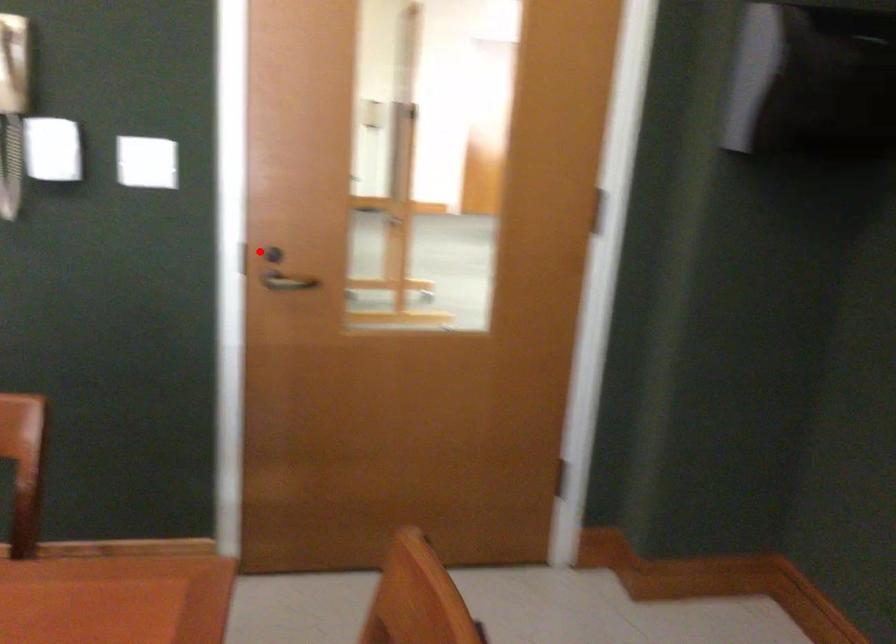
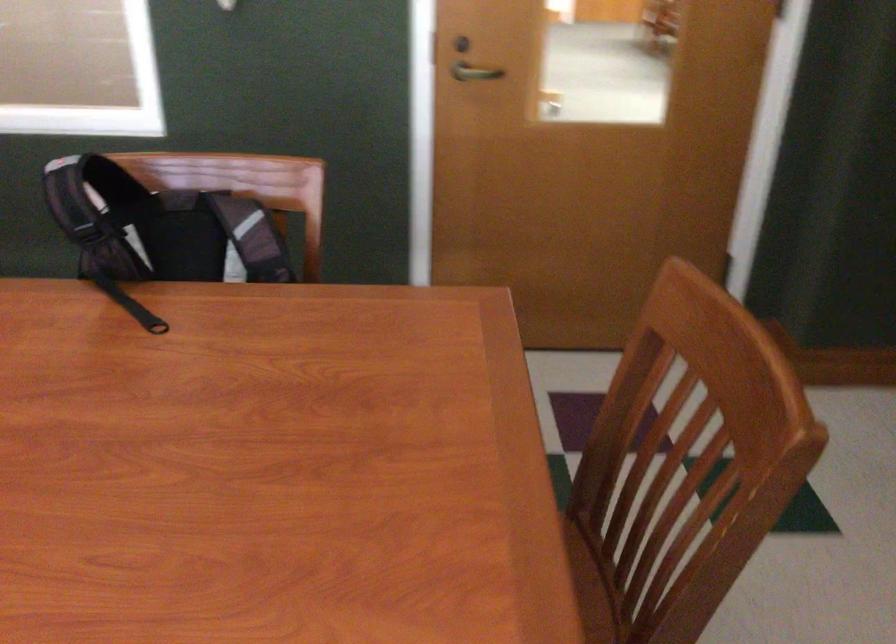
The point at the highlighted location is marked in the first image. Where is the corresponding point in the second image?

(460, 44)